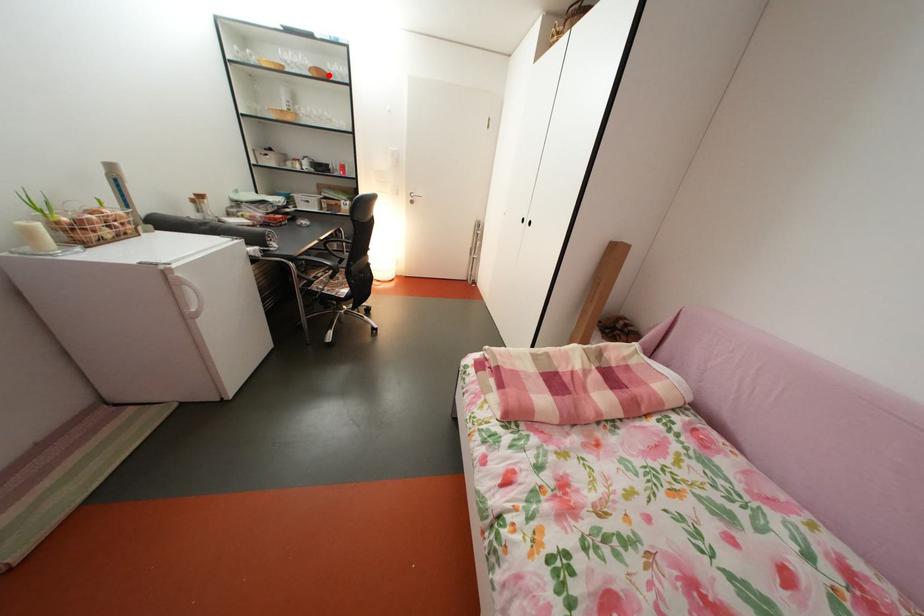
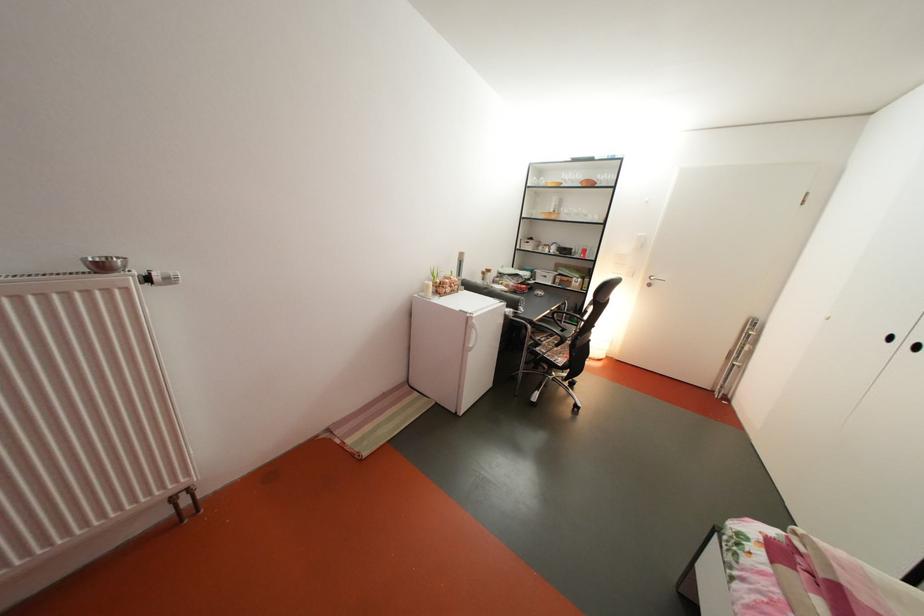
Question: I am providing you with two images of the same scene from different viewpoints. In image1, a red point is highlighted. Considering the same 3D point in image2, which of the following is correct?

Choices:
 (A) It is closer
 (B) It is farther

Answer: (A)